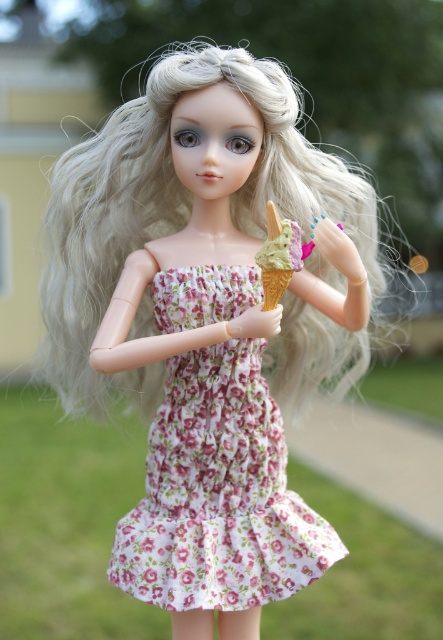
Question: Can you confirm if floral cotton dress at center is thinner than green matte ice cream cone at center?

Choices:
 (A) no
 (B) yes

Answer: (A)

Question: Observing the image, what is the correct spatial positioning of blonde silky hair at center in reference to green matte ice cream cone at center?

Choices:
 (A) above
 (B) below

Answer: (A)

Question: Which object is the farthest from the green matte ice cream cone at center?

Choices:
 (A) floral cotton dress at center
 (B) blonde silky hair at center

Answer: (A)

Question: Among these points, which one is nearest to the camera?

Choices:
 (A) (275, 275)
 (B) (171, 64)
 (C) (229, 403)

Answer: (A)

Question: Which object is closer to the camera taking this photo?

Choices:
 (A) green matte ice cream cone at center
 (B) blonde silky hair at center
 (C) floral cotton dress at center

Answer: (A)

Question: Can you confirm if blonde silky hair at center is positioned to the right of floral cotton dress at center?

Choices:
 (A) yes
 (B) no

Answer: (B)